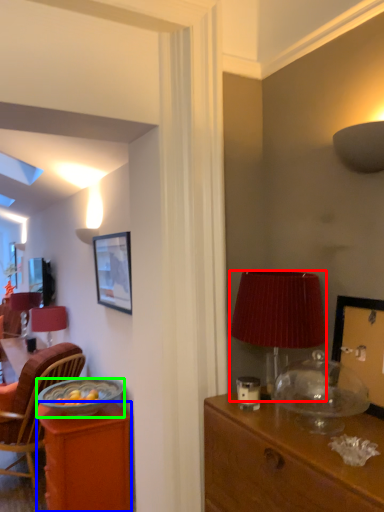
Question: Considering the real-world distances, which object is farthest from lamp (highlighted by a red box)? desk (highlighted by a blue box) or bowl (highlighted by a green box)?

Choices:
 (A) desk
 (B) bowl

Answer: (A)